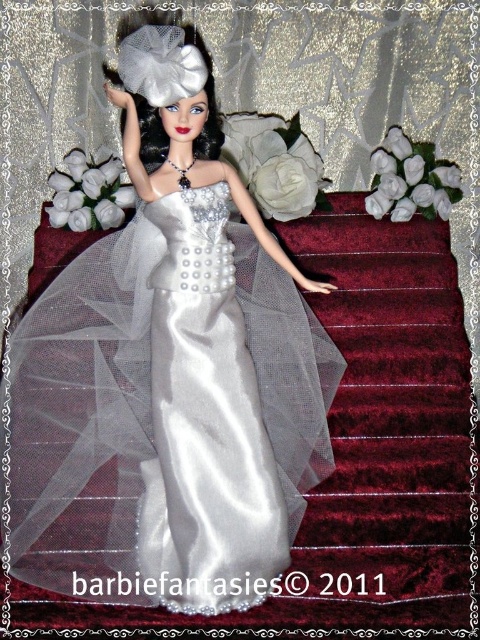
The image shows a doll in a silver gown standing on red velvet stairs. There is a point at coordinates [168,376]. What object is located at this point?

The point at coordinates [168,376] corresponds to the satin dress at center.